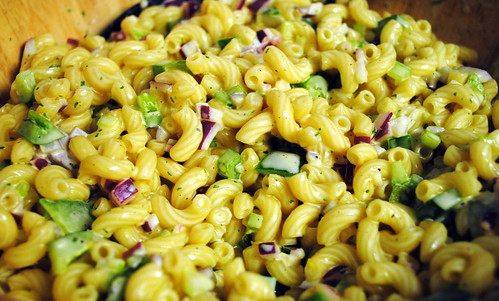
Find the location of a particular element. The width and height of the screenshot is (499, 301). food area in the bottom left corner is located at coordinates (30, 270).